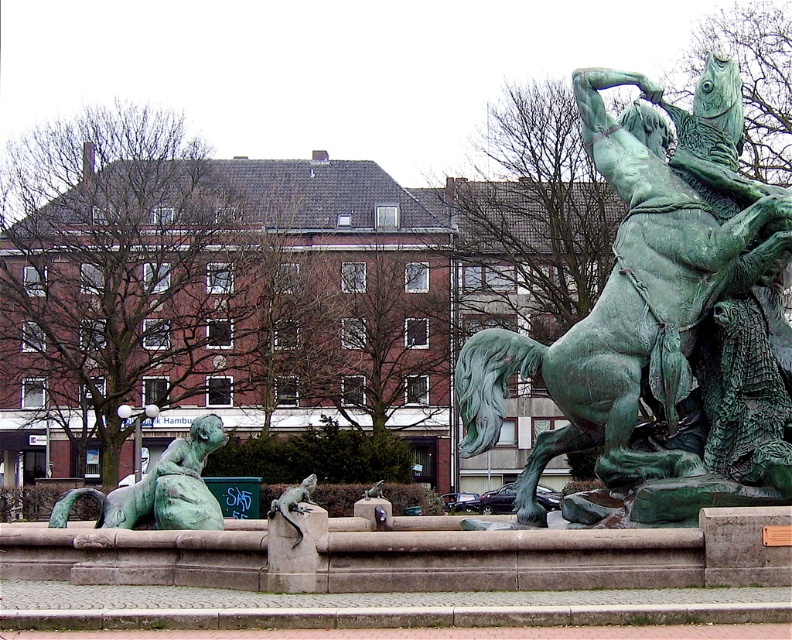
You are a sculptor examining the statue and fountain in the public square. You need to determine which object, the green patina horse at center or the green patina statue at lower left, requires more height adjustments to fit within the fountain base. Based on their current heights, which one might need more work?

The green patina horse at center is taller than the green patina statue at lower left, so it would require more height adjustments to fit within the fountain base.

You are standing in the public square and want to take a photo of the statue. The statue is at point (655,198). If your camera has a focal length of 50mm and you want to capture the entire statue in the frame, what is the minimum distance you should stand from the statue to ensure it fits?

The point (655,198) is 24.57 meters from the camera. To capture the entire statue at this distance with a 50mm lens, you should position yourself at least 24.57 meters away to ensure the statue fits within the frame.

You are standing in front of the statue and want to take a photo. You notice two points on the statue marked as point 1 at coordinate (718,497) and point 2 at coordinate (143,481). Which point is closer to you when you are facing the statue?

Point 1 at coordinate (718,497) is closer to the viewer than point 2 at coordinate (143,481).